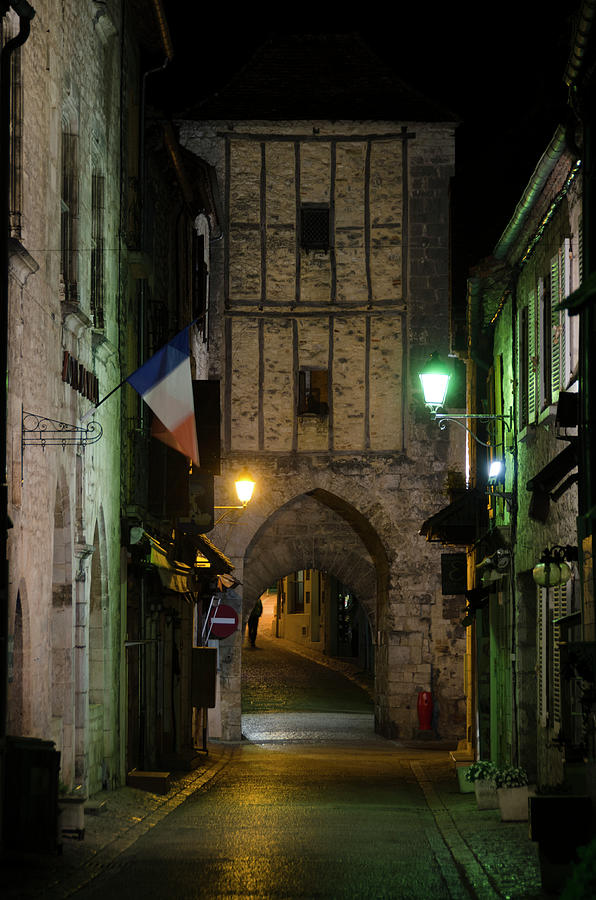
Find the location of a particular element. Image resolution: width=596 pixels, height=900 pixels. square pots white is located at coordinates (511, 802), (479, 779), (465, 777).